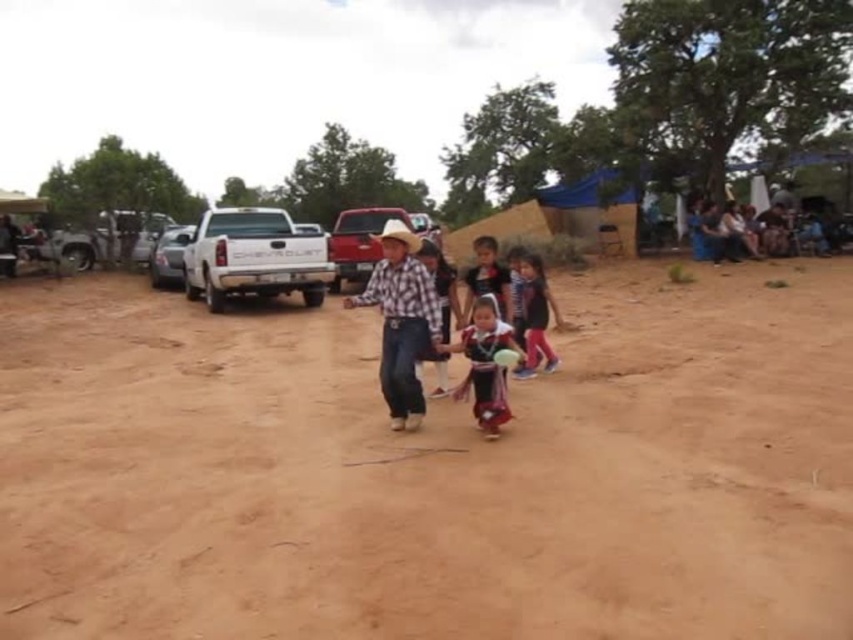
Question: Which object appears farthest from the camera in this image?

Choices:
 (A) plaid fabric shirt at center
 (B) matte black dress at center
 (C) dark blue fabric dress at center

Answer: (C)

Question: Is plaid fabric shirt at center wider than embroidered fabric dress at center?

Choices:
 (A) no
 (B) yes

Answer: (B)

Question: Which point appears closest to the camera in this image?

Choices:
 (A) (404, 272)
 (B) (395, 536)

Answer: (B)

Question: Which of the following is the farthest from the observer?

Choices:
 (A) (502, 381)
 (B) (354, 307)
 (C) (141, 328)
 (D) (479, 284)

Answer: (C)

Question: Can you confirm if brown sandy ground at center is thinner than plaid fabric shirt at center?

Choices:
 (A) yes
 (B) no

Answer: (B)

Question: Does dark blue fabric dress at center appear under matte black dress at center?

Choices:
 (A) no
 (B) yes

Answer: (B)